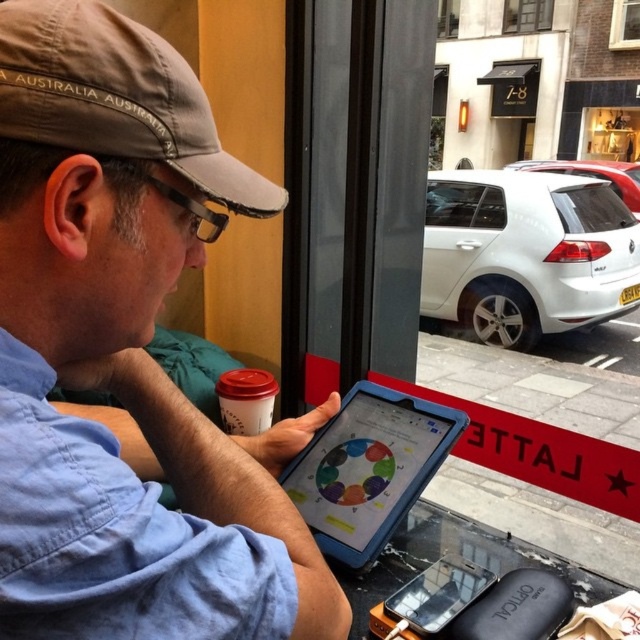
Does blue rubberized tablet at center appear on the left side of clear glass window at upper center?

Yes, blue rubberized tablet at center is to the left of clear glass window at upper center.

Who is higher up, blue rubberized tablet at center or clear glass window at upper center?

Positioned higher is clear glass window at upper center.

Between point (412, 481) and point (509, 4), which one is positioned in front?

Point (412, 481) is in front.

Find the location of a particular element. blue rubberized tablet at center is located at coordinates (369, 468).

Is gray fabric baseball cap at upper left bigger than transparent glass window at upper center?

Incorrect, gray fabric baseball cap at upper left is not larger than transparent glass window at upper center.

Between point (35, 88) and point (456, 4), which one is positioned behind?

The point (456, 4) is behind.

You are a GUI agent. You are given a task and a screenshot of the screen. Output one action in this format:
    pyautogui.click(x=<x>, y=<y>)
    Task: Click on the gray fabric baseball cap at upper left
    The width and height of the screenshot is (640, 640).
    Given the screenshot: What is the action you would take?
    click(115, 97)

Which of these two, matte plastic tablet at center or transparent glass window at upper center, stands shorter?

matte plastic tablet at center

Is point (436, 600) less distant than point (452, 22)?

Yes, point (436, 600) is in front of point (452, 22).

Locate an element on the screen. The height and width of the screenshot is (640, 640). matte plastic tablet at center is located at coordinates (438, 593).

This screenshot has height=640, width=640. I want to click on matte plastic tablet at center, so click(x=438, y=593).